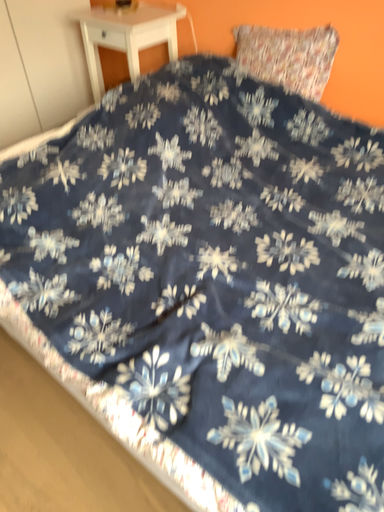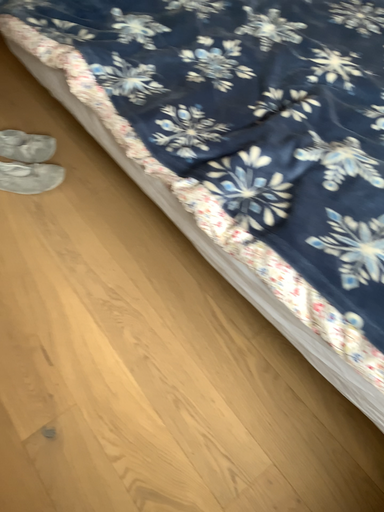
Question: Which way did the camera rotate in the video?

Choices:
 (A) rotated right
 (B) rotated left

Answer: (B)